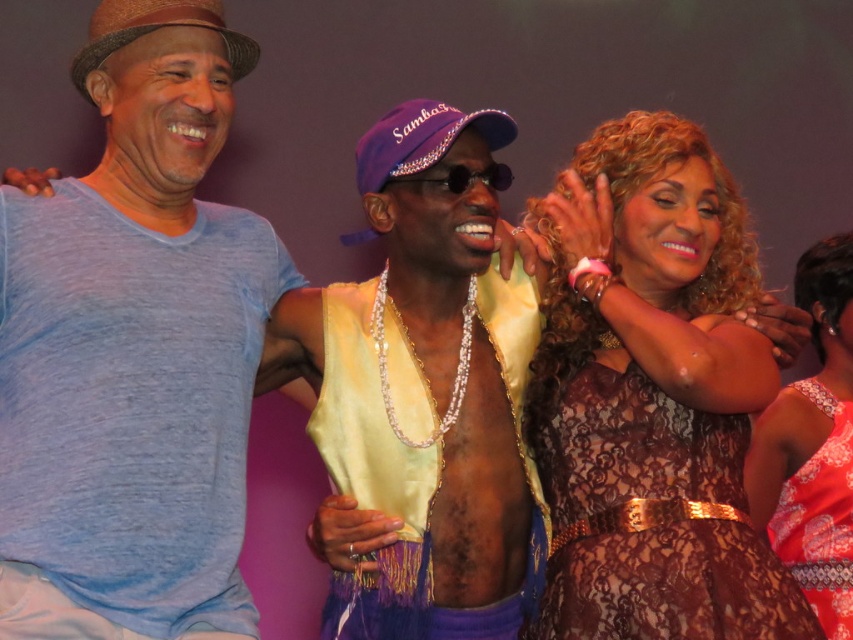
Between blue cotton t-shirt at left and brown lace dress at center, which one is positioned lower?

brown lace dress at center is below.

Is blue cotton t-shirt at left above brown lace dress at center?

Indeed, blue cotton t-shirt at left is positioned over brown lace dress at center.

Does point (210, 435) lie in front of point (611, 120)?

Yes, it is in front of point (611, 120).

Find the location of a particular element. blue cotton t-shirt at left is located at coordinates (135, 346).

Does blue cotton t-shirt at left appear on the left side of lace dress at right?

Correct, you'll find blue cotton t-shirt at left to the left of lace dress at right.

Does blue cotton t-shirt at left appear on the right side of lace dress at right?

Incorrect, blue cotton t-shirt at left is not on the right side of lace dress at right.

I want to click on blue cotton t-shirt at left, so click(135, 346).

This screenshot has height=640, width=853. Find the location of `blue cotton t-shirt at left`. blue cotton t-shirt at left is located at coordinates (135, 346).

Is point (654, 163) positioned before point (828, 454)?

Yes, it is.

Which of these two, brown lace dress at center or lace dress at right, stands shorter?

brown lace dress at center

Who is more distant from viewer, (648, 536) or (827, 342)?

Positioned behind is point (827, 342).

The height and width of the screenshot is (640, 853). Identify the location of brown lace dress at center. (653, 397).